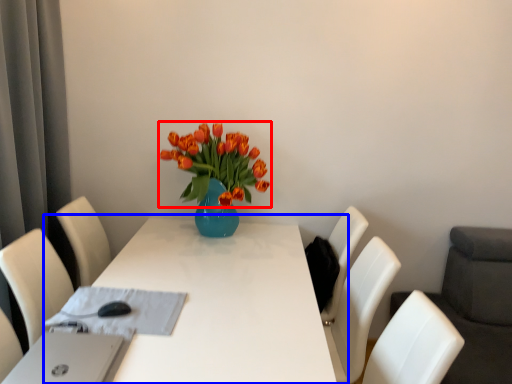
Question: Among these objects, which one is farthest to the camera, flower (highlighted by a red box) or table (highlighted by a blue box)?

Choices:
 (A) flower
 (B) table

Answer: (A)